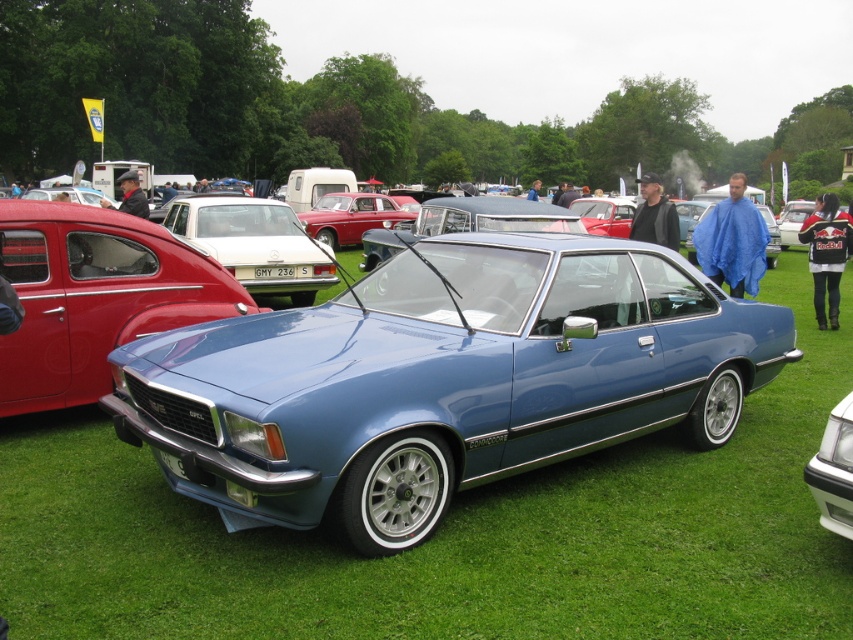
Question: Among these objects, which one is nearest to the camera?

Choices:
 (A) white plastic license plate at center
 (B) metallic silver coupe at center
 (C) matte red sedan at left

Answer: (C)

Question: Among these objects, which one is farthest from the camera?

Choices:
 (A) matte red sedan at left
 (B) matte red car at center
 (C) metallic blue car at center

Answer: (B)

Question: Does green grass at center appear under white plastic license plate at center?

Choices:
 (A) no
 (B) yes

Answer: (B)

Question: Among these points, which one is nearest to the camera?

Choices:
 (A) (292, 268)
 (B) (335, 234)
 (C) (851, 449)
 (D) (569, 634)

Answer: (D)

Question: Does green grass at center lie behind white plastic license plate at center?

Choices:
 (A) yes
 (B) no

Answer: (B)

Question: Is matte red sedan at left to the left of matte red car at center from the viewer's perspective?

Choices:
 (A) yes
 (B) no

Answer: (B)